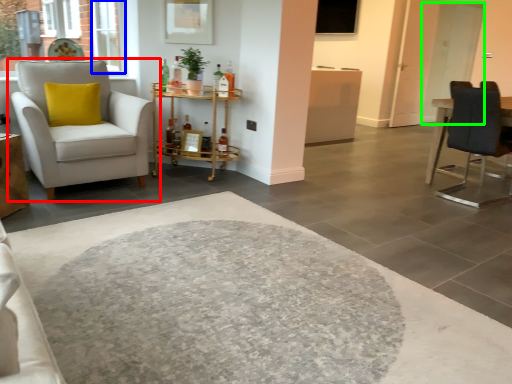
Question: Which object is positioned closest to chair (highlighted by a red box)? Select from window (highlighted by a blue box) and glass door (highlighted by a green box).

Choices:
 (A) window
 (B) glass door

Answer: (A)